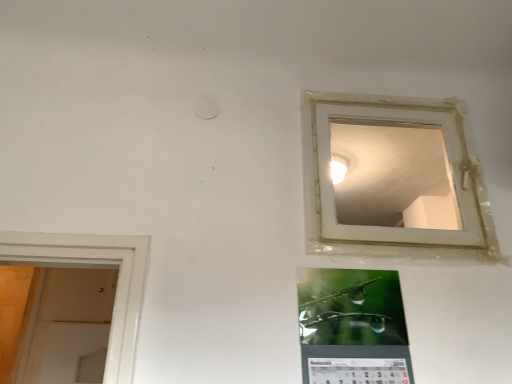
Question: Can you confirm if transparent plastic window at upper right is bigger than green glossy calendar at lower center?

Choices:
 (A) no
 (B) yes

Answer: (B)

Question: From a real-world perspective, is transparent plastic window at upper right beneath green glossy calendar at lower center?

Choices:
 (A) no
 (B) yes

Answer: (A)

Question: Is transparent plastic window at upper right shorter than green glossy calendar at lower center?

Choices:
 (A) no
 (B) yes

Answer: (A)

Question: From the image's perspective, is transparent plastic window at upper right over green glossy calendar at lower center?

Choices:
 (A) yes
 (B) no

Answer: (A)

Question: Is transparent plastic window at upper right in contact with green glossy calendar at lower center?

Choices:
 (A) no
 (B) yes

Answer: (A)

Question: From a real-world perspective, is transparent plastic window at upper right physically above green glossy calendar at lower center?

Choices:
 (A) yes
 (B) no

Answer: (A)

Question: Could you tell me if green glossy calendar at lower center is facing transparent plastic window at upper right?

Choices:
 (A) yes
 (B) no

Answer: (B)

Question: Can you confirm if green glossy calendar at lower center is wider than transparent plastic window at upper right?

Choices:
 (A) yes
 (B) no

Answer: (A)

Question: Can you confirm if green glossy calendar at lower center is shorter than transparent plastic window at upper right?

Choices:
 (A) yes
 (B) no

Answer: (A)

Question: Considering the relative positions of green glossy calendar at lower center and transparent plastic window at upper right in the image provided, is green glossy calendar at lower center to the left of transparent plastic window at upper right from the viewer's perspective?

Choices:
 (A) no
 (B) yes

Answer: (B)

Question: Is green glossy calendar at lower center outside transparent plastic window at upper right?

Choices:
 (A) yes
 (B) no

Answer: (A)

Question: Considering the relative positions of green glossy calendar at lower center and transparent plastic window at upper right in the image provided, is green glossy calendar at lower center to the right of transparent plastic window at upper right from the viewer's perspective?

Choices:
 (A) yes
 (B) no

Answer: (B)

Question: Considering their positions, is green glossy calendar at lower center located in front of or behind transparent plastic window at upper right?

Choices:
 (A) behind
 (B) front

Answer: (B)